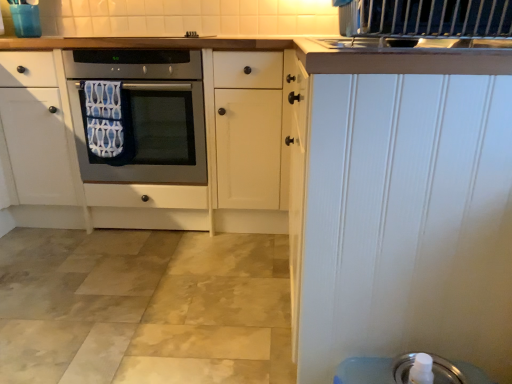
Question: From a real-world perspective, relative to blue patterned towel at center, is white painted wood door at upper right vertically above or below?

Choices:
 (A) below
 (B) above

Answer: (A)

Question: Considering the positions of white painted wood door at upper right and blue patterned towel at center in the image, is white painted wood door at upper right wider or thinner than blue patterned towel at center?

Choices:
 (A) thin
 (B) wide

Answer: (B)

Question: Estimate the real-world distances between objects in this image. Which object is farther from the silver metallic soap dispenser at lower right?

Choices:
 (A) satin silver oven at center
 (B) white painted wood door at upper right
 (C) blue patterned towel at center

Answer: (C)

Question: Based on their relative distances, which object is farther from the white painted wood door at upper right?

Choices:
 (A) silver metallic soap dispenser at lower right
 (B) satin silver oven at center
 (C) blue patterned towel at center

Answer: (C)